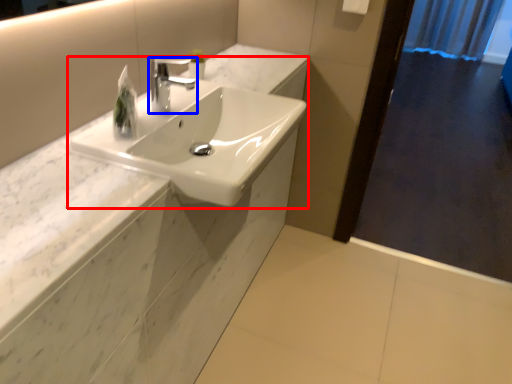
Question: Among these objects, which one is farthest to the camera, sink (highlighted by a red box) or tap (highlighted by a blue box)?

Choices:
 (A) sink
 (B) tap

Answer: (B)